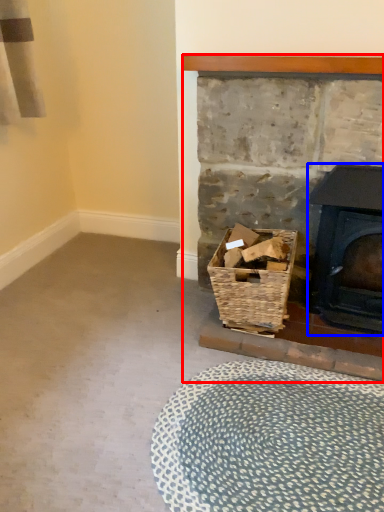
Question: Which point is further to the camera, fireplace (highlighted by a red box) or wood burning stove (highlighted by a blue box)?

Choices:
 (A) fireplace
 (B) wood burning stove

Answer: (B)